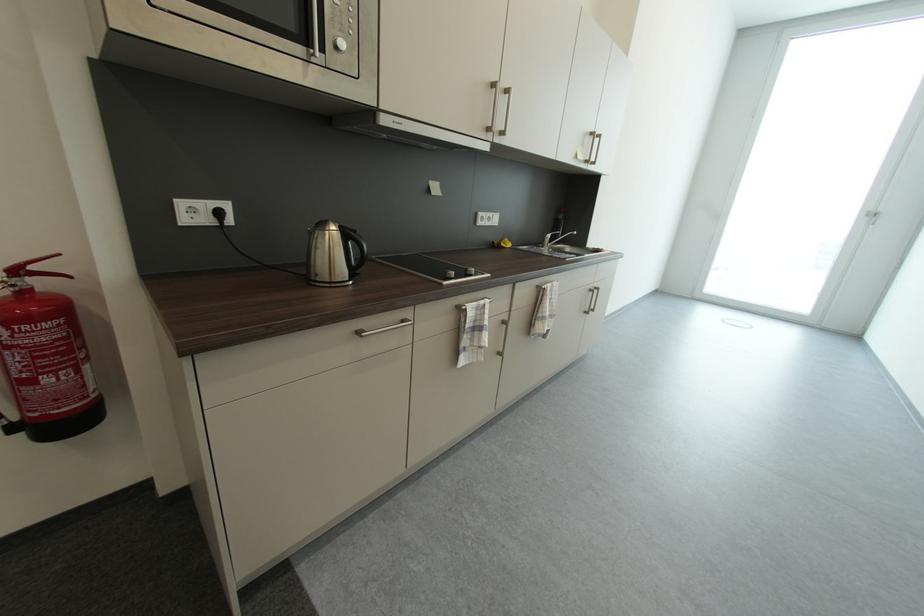
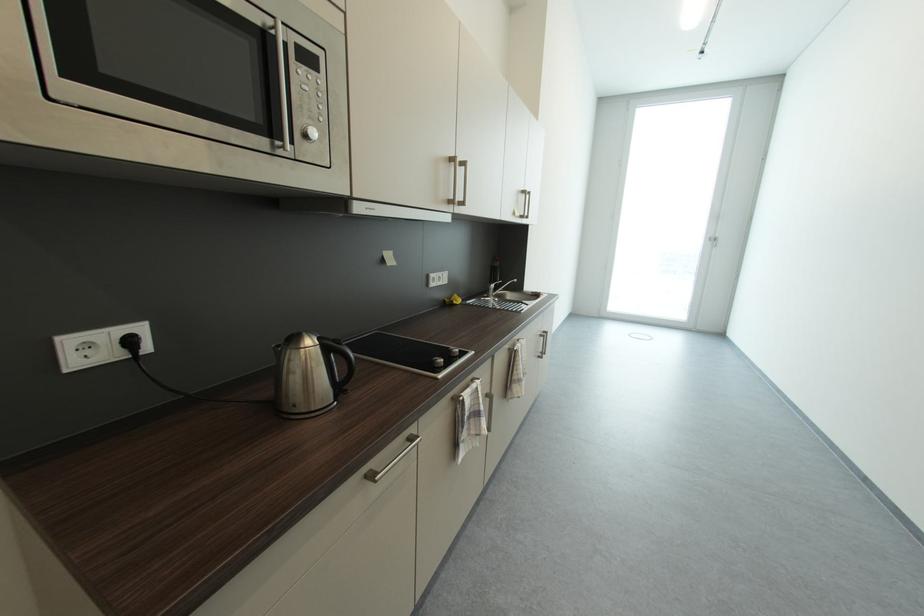
Find the pixel in the second image that matches point (348, 46) in the first image.

(321, 134)